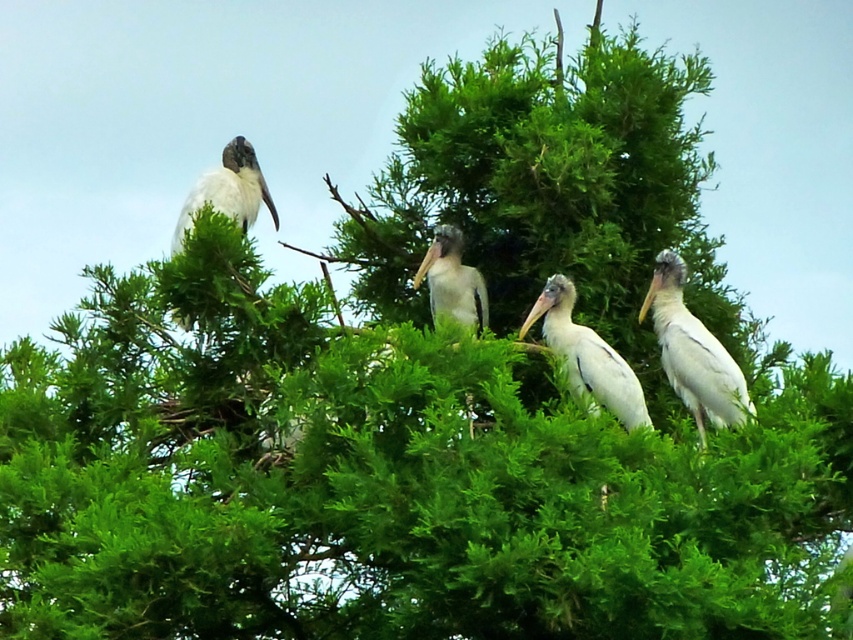
Between point (634, 403) and point (183, 205), which one is positioned in front?

Positioned in front is point (634, 403).

Does white matte stork at center have a greater height compared to white matte stork at upper left?

Yes, white matte stork at center is taller than white matte stork at upper left.

Between point (579, 360) and point (248, 182), which one is positioned behind?

Positioned behind is point (248, 182).

I want to click on white matte stork at center, so click(x=585, y=356).

Between white matte stork at center and white feathered bird at center, which one appears on the right side from the viewer's perspective?

Positioned to the right is white matte stork at center.

Who is more forward, (640, 406) or (479, 317)?

Point (640, 406) is in front.

Where is `white matte stork at center`? white matte stork at center is located at coordinates (585, 356).

Between white matte stork at upper right and white matte stork at center, which one appears on the left side from the viewer's perspective?

white matte stork at center is more to the left.

Who is more distant from viewer, (706, 372) or (611, 394)?

Positioned behind is point (706, 372).

Locate an element on the screen. This screenshot has height=640, width=853. white matte stork at upper right is located at coordinates (693, 353).